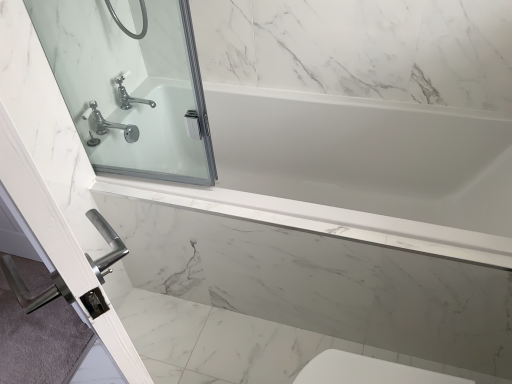
Identify the location of chrome metallic faucet at upper left. This screenshot has width=512, height=384. (111, 125).

This screenshot has height=384, width=512. In order to click on mirror on the left of the white glossy bathtub at center in this screenshot , I will do `click(131, 85)`.

From a real-world perspective, is white glossy bathtub at center positioned above or below clear glass shower door at upper left?

In terms of real-world spatial position, white glossy bathtub at center is below clear glass shower door at upper left.

Consider the image. From the image's perspective, which is above, white glossy bathtub at center or clear glass shower door at upper left?

From the image's view, clear glass shower door at upper left is above.

From their relative heights in the image, would you say clear glass shower door at upper left is taller or shorter than chrome metallic faucet at upper left?

Clearly, clear glass shower door at upper left is taller compared to chrome metallic faucet at upper left.

Between clear glass shower door at upper left and chrome metallic faucet at upper left, which one appears on the right side from the viewer's perspective?

Positioned to the right is clear glass shower door at upper left.

How many degrees apart are the facing directions of clear glass shower door at upper left and chrome metallic faucet at upper left?

The angle between the facing direction of clear glass shower door at upper left and the facing direction of chrome metallic faucet at upper left is 90 degrees.

Consider the image. Would you say clear glass door at upper left is part of clear glass shower door at upper left's contents?

No, clear glass door at upper left is not a part of clear glass shower door at upper left.

Is clear glass shower door at upper left facing away from clear glass door at upper left?

clear glass shower door at upper left does not have its back to clear glass door at upper left.

Considering the relative sizes of clear glass shower door at upper left and clear glass door at upper left in the image provided, is clear glass shower door at upper left shorter than clear glass door at upper left?

Yes, clear glass shower door at upper left is shorter than clear glass door at upper left.

Can you confirm if clear glass shower door at upper left is smaller than clear glass door at upper left?

Correct, clear glass shower door at upper left occupies less space than clear glass door at upper left.

Does clear glass door at upper left lie in front of white glossy bathtub at center?

Yes, it is in front of white glossy bathtub at center.

Is clear glass door at upper left inside or outside of white glossy bathtub at center?

clear glass door at upper left is spatially situated outside white glossy bathtub at center.

Which is more to the left, clear glass door at upper left or white glossy bathtub at center?

Positioned to the left is clear glass door at upper left.

Considering the sizes of objects clear glass door at upper left and white glossy bathtub at center in the image provided, who is thinner, clear glass door at upper left or white glossy bathtub at center?

With smaller width is clear glass door at upper left.

Find the location of a particular element. The height and width of the screenshot is (384, 512). mirror in front of the white glossy bathtub at center is located at coordinates (131, 85).

Is point (72, 95) closer or farther from the camera than point (225, 193)?

Point (72, 95) is positioned farther from the camera compared to point (225, 193).

In terms of width, does clear glass shower door at upper left look wider or thinner when compared to white glossy bathtub at center?

In the image, clear glass shower door at upper left appears to be more narrow than white glossy bathtub at center.

Is clear glass door at upper left positioned far away from clear glass shower door at upper left?

No, clear glass door at upper left is not far from clear glass shower door at upper left.

Image resolution: width=512 pixels, height=384 pixels. I want to click on screen door below the clear glass shower door at upper left (from the image's perspective), so click(54, 177).

Would you say clear glass door at upper left contains clear glass shower door at upper left?

No.

Is clear glass door at upper left not near chrome metallic faucet at upper left?

No, clear glass door at upper left is not far away from chrome metallic faucet at upper left.

From a real-world perspective, is clear glass door at upper left positioned over chrome metallic faucet at upper left based on gravity?

Yes, from a real-world perspective, clear glass door at upper left is above chrome metallic faucet at upper left.

Between clear glass door at upper left and chrome metallic faucet at upper left, which one has larger width?

chrome metallic faucet at upper left is wider.

Image resolution: width=512 pixels, height=384 pixels. What are the coordinates of `bathtub below the clear glass shower door at upper left (from the image's perspective)` in the screenshot? It's located at (355, 172).

You are a GUI agent. You are given a task and a screenshot of the screen. Output one action in this format:
    pyautogui.click(x=<x>, y=<y>)
    Task: Click on the tap behind the clear glass shower door at upper left
    The image size is (512, 384).
    Given the screenshot: What is the action you would take?
    pyautogui.click(x=111, y=125)

Based on their spatial positions, is clear glass shower door at upper left or clear glass door at upper left closer to chrome metallic faucet at upper left?

Among the two, clear glass shower door at upper left is located nearer to chrome metallic faucet at upper left.

Considering their positions, is white glossy bathtub at center positioned further to chrome metallic faucet at upper left than clear glass door at upper left?

white glossy bathtub at center is further to chrome metallic faucet at upper left.

Based on the photo, considering their positions, is clear glass shower door at upper left positioned closer to white glossy bathtub at center than chrome metallic faucet at upper left?

The object closer to white glossy bathtub at center is clear glass shower door at upper left.

Estimate the real-world distances between objects in this image. Which object is further from clear glass door at upper left, chrome metallic faucet at upper left or clear glass shower door at upper left?

clear glass shower door at upper left lies further to clear glass door at upper left than the other object.

Based on their spatial positions, is chrome metallic faucet at upper left or white glossy bathtub at center closer to clear glass shower door at upper left?

chrome metallic faucet at upper left is closer to clear glass shower door at upper left.

Which object lies further to the anchor point clear glass shower door at upper left, white glossy bathtub at center or clear glass door at upper left?

white glossy bathtub at center is further to clear glass shower door at upper left.

Estimate the real-world distances between objects in this image. Which object is further from chrome metallic faucet at upper left, clear glass door at upper left or clear glass shower door at upper left?

clear glass door at upper left lies further to chrome metallic faucet at upper left than the other object.

Which object lies nearer to the anchor point white glossy bathtub at center, clear glass door at upper left or clear glass shower door at upper left?

The object closer to white glossy bathtub at center is clear glass shower door at upper left.

Where is `mirror positioned between clear glass door at upper left and white glossy bathtub at center from near to far`? mirror positioned between clear glass door at upper left and white glossy bathtub at center from near to far is located at coordinates (131, 85).

Find the location of a particular element. Image resolution: width=512 pixels, height=384 pixels. mirror between clear glass door at upper left and chrome metallic faucet at upper left in the front-back direction is located at coordinates (131, 85).

You are a GUI agent. You are given a task and a screenshot of the screen. Output one action in this format:
    pyautogui.click(x=<x>, y=<y>)
    Task: Click on the bathtub located between clear glass door at upper left and chrome metallic faucet at upper left in the depth direction
    The height and width of the screenshot is (384, 512).
    Given the screenshot: What is the action you would take?
    pyautogui.click(x=355, y=172)

Locate an element on the screen. This screenshot has height=384, width=512. mirror located between chrome metallic faucet at upper left and white glossy bathtub at center in the left-right direction is located at coordinates (131, 85).